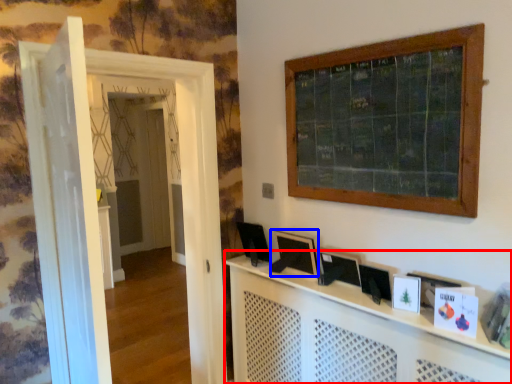
Question: Which of the following is the closest to the observer, computer desk (highlighted by a red box) or picture frame (highlighted by a blue box)?

Choices:
 (A) computer desk
 (B) picture frame

Answer: (A)